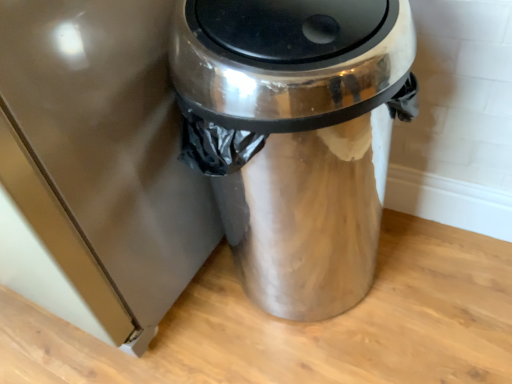
Image resolution: width=512 pixels, height=384 pixels. Find the location of `vacant area that is situated to the right of polished stainless steel trash can at center`. vacant area that is situated to the right of polished stainless steel trash can at center is located at coordinates (449, 279).